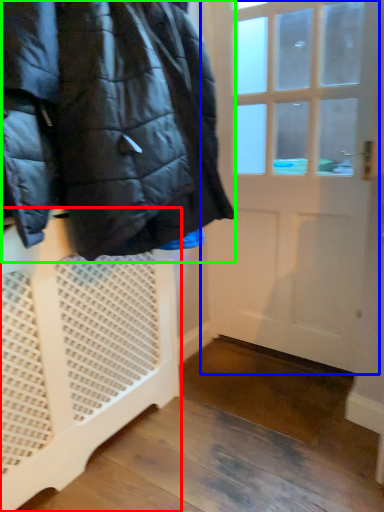
Question: Which object is positioned farthest from furniture (highlighted by a red box)? Select from door (highlighted by a blue box) and jacket (highlighted by a green box).

Choices:
 (A) door
 (B) jacket

Answer: (A)